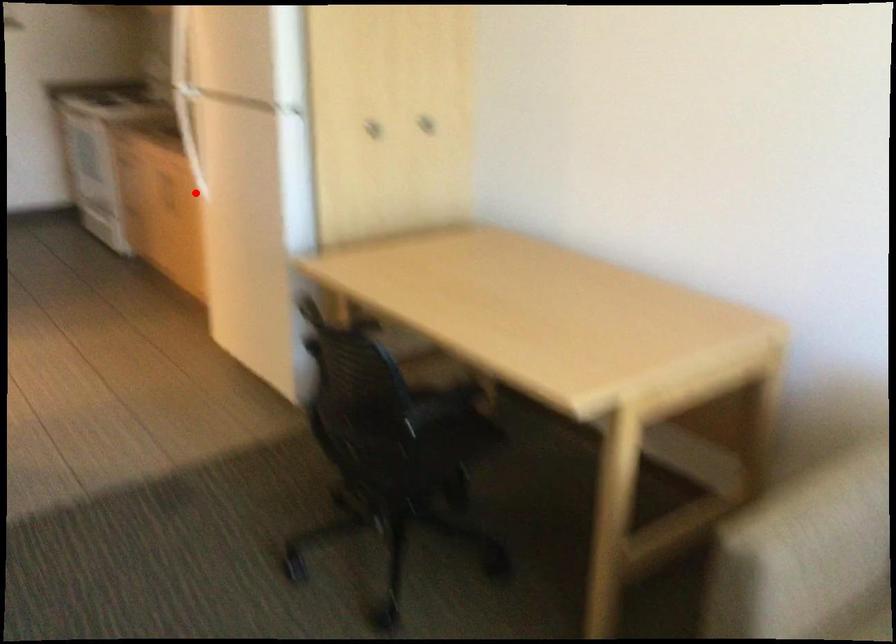
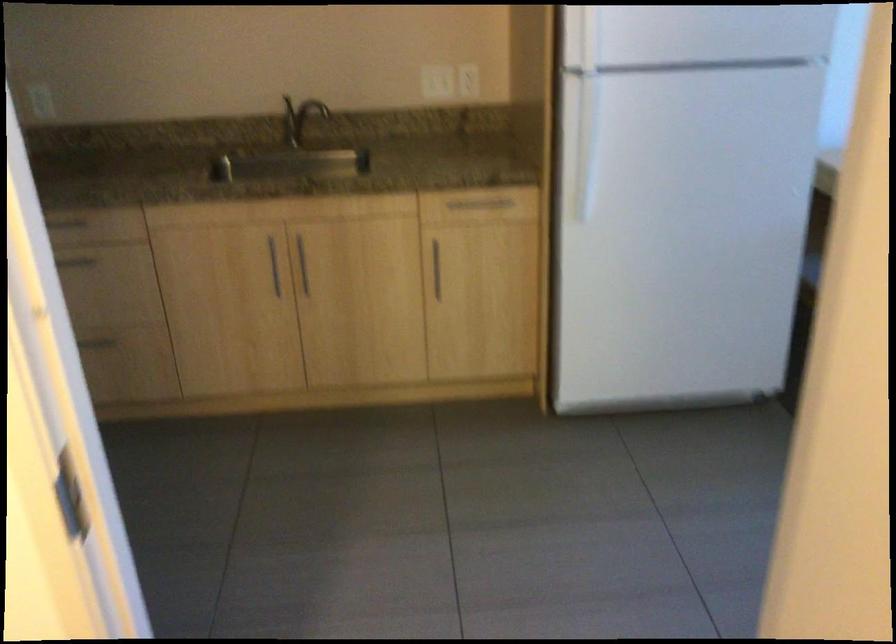
Where in the second image is the point corresponding to the highlighted location from the first image?

(303, 265)